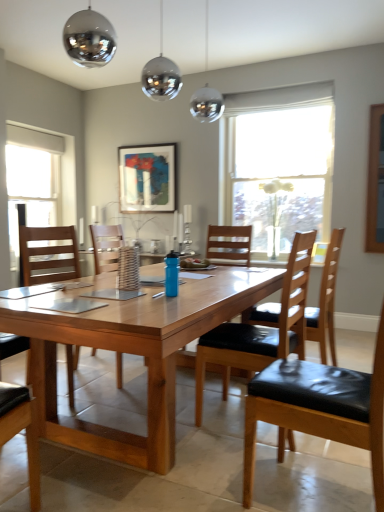
Locate an element on the screen. vacant space in front of blue matte water bottle at center is located at coordinates (168, 302).